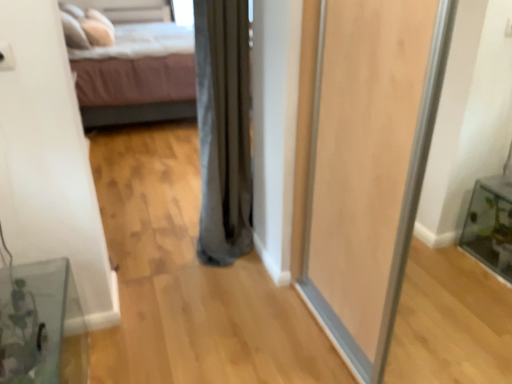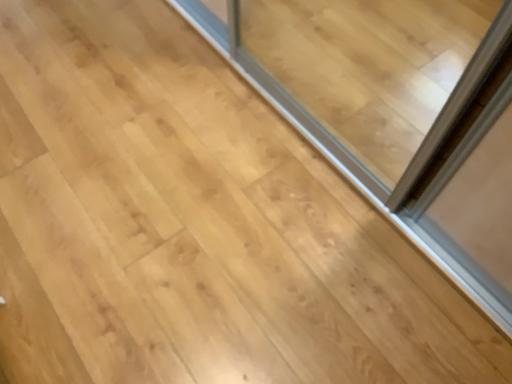
Question: How did the camera likely rotate when shooting the video?

Choices:
 (A) rotated left
 (B) rotated right

Answer: (B)